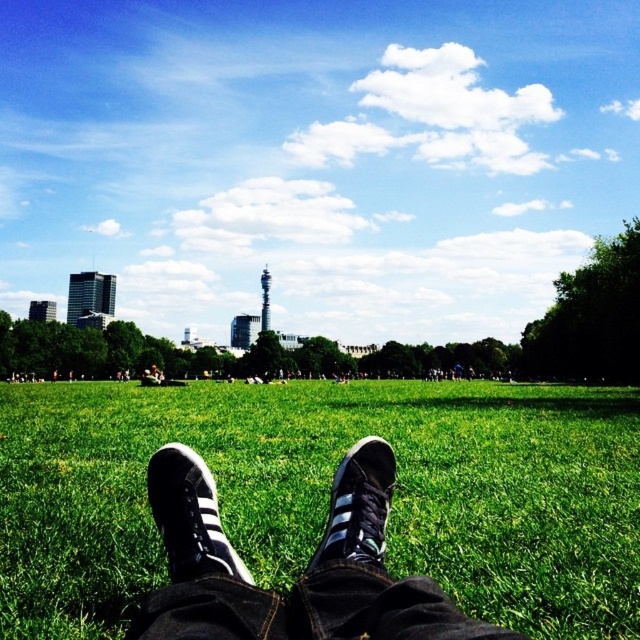
Question: Is green grass at center thinner than black suede shoe at center?

Choices:
 (A) no
 (B) yes

Answer: (A)

Question: Can you confirm if black suede sneakers at center is positioned below black suede shoe at center?

Choices:
 (A) yes
 (B) no

Answer: (A)

Question: Among these objects, which one is farthest from the camera?

Choices:
 (A) black suede shoe at center
 (B) black suede sneaker at lower center

Answer: (A)

Question: Which point is farther from the camera taking this photo?

Choices:
 (A) (365, 616)
 (B) (365, 433)
 (C) (364, 451)

Answer: (B)

Question: Does green grass at center have a larger size compared to black suede shoe at center?

Choices:
 (A) no
 (B) yes

Answer: (B)

Question: Estimate the real-world distances between objects in this image. Which object is farther from the black suede sneakers at center?

Choices:
 (A) black suede sneaker at lower center
 (B) black suede shoe at center
 (C) green grass at center

Answer: (C)